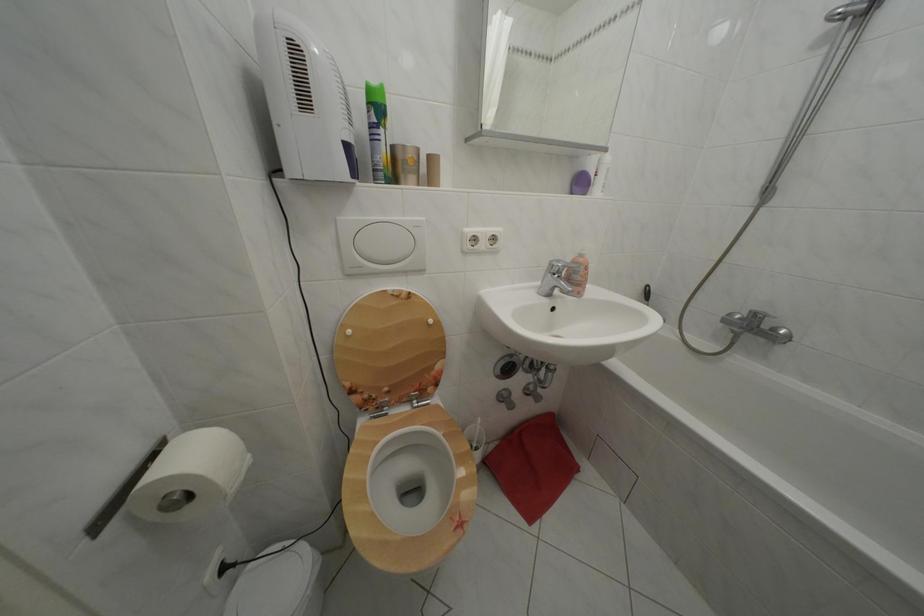
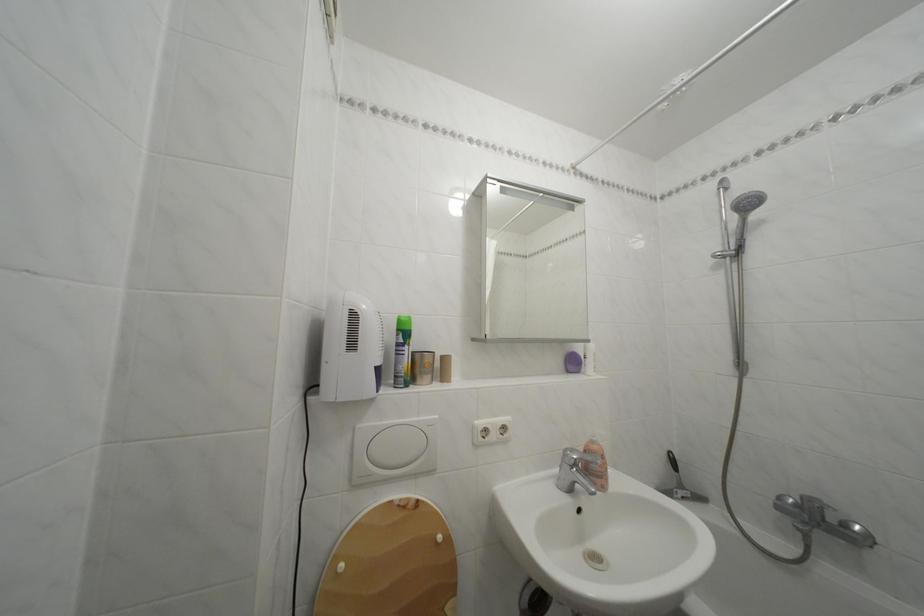
The point at (348,225) is marked in the first image. Where is the corresponding point in the second image?

(368, 432)